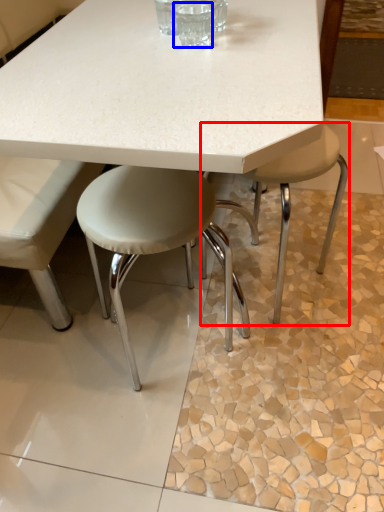
Question: Among these objects, which one is farthest to the camera, stool (highlighted by a red box) or clear (highlighted by a blue box)?

Choices:
 (A) stool
 (B) clear

Answer: (A)